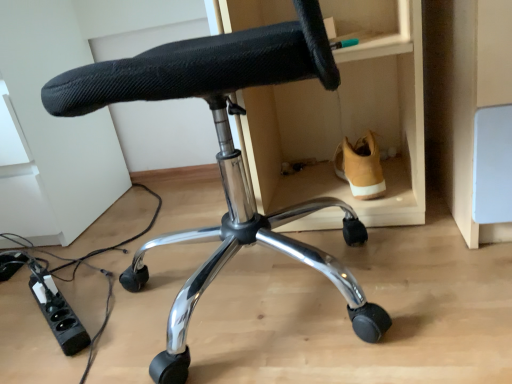
Question: From a real-world perspective, is tan suede shoe at lower right below black plastic power strip at lower left?

Choices:
 (A) no
 (B) yes

Answer: (A)

Question: Does tan suede shoe at lower right have a greater height compared to black plastic power strip at lower left?

Choices:
 (A) no
 (B) yes

Answer: (B)

Question: Could you tell me if tan suede shoe at lower right is facing black plastic power strip at lower left?

Choices:
 (A) no
 (B) yes

Answer: (A)

Question: Is tan suede shoe at lower right turned away from black plastic power strip at lower left?

Choices:
 (A) no
 (B) yes

Answer: (A)

Question: Is tan suede shoe at lower right closer to camera compared to black plastic power strip at lower left?

Choices:
 (A) yes
 (B) no

Answer: (B)

Question: From the image's perspective, does tan suede shoe at lower right appear lower than black plastic power strip at lower left?

Choices:
 (A) no
 (B) yes

Answer: (A)

Question: Does black plastic power strip at lower left contain black mesh chair at center?

Choices:
 (A) yes
 (B) no

Answer: (B)

Question: Can you confirm if black plastic power strip at lower left is positioned to the left of black mesh chair at center?

Choices:
 (A) no
 (B) yes

Answer: (B)

Question: Is black plastic power strip at lower left looking in the opposite direction of black mesh chair at center?

Choices:
 (A) yes
 (B) no

Answer: (B)

Question: Is black plastic power strip at lower left next to black mesh chair at center and touching it?

Choices:
 (A) yes
 (B) no

Answer: (B)

Question: Does black plastic power strip at lower left come behind black mesh chair at center?

Choices:
 (A) yes
 (B) no

Answer: (A)

Question: From a real-world perspective, is black plastic power strip at lower left located higher than black mesh chair at center?

Choices:
 (A) no
 (B) yes

Answer: (A)

Question: From a real-world perspective, is black plastic power strip at lower left positioned under tan suede shoe at lower right based on gravity?

Choices:
 (A) yes
 (B) no

Answer: (A)